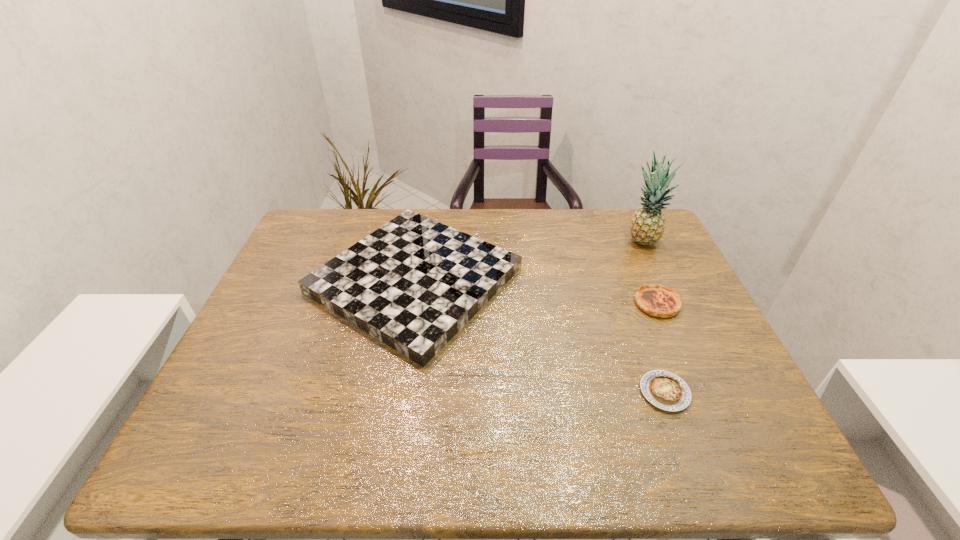
Find the location of a particular element. vacant space at the right edge is located at coordinates (702, 396).

Locate an element on the screen. The width and height of the screenshot is (960, 540). free spot between the farther quiche and the checkerboard is located at coordinates (536, 292).

The height and width of the screenshot is (540, 960). Find the location of `free space between the leftmost object and the nearest object`. free space between the leftmost object and the nearest object is located at coordinates (540, 336).

Identify the location of free space between the third tallest object and the pineapple. (649, 272).

This screenshot has width=960, height=540. What are the coordinates of `free area in between the farther quiche and the nearest object` in the screenshot? It's located at (660, 348).

The height and width of the screenshot is (540, 960). In order to click on blank region between the leftmost object and the farther quiche in this screenshot , I will do `click(536, 292)`.

Locate an element on the screen. The width and height of the screenshot is (960, 540). blank region between the taller quiche and the tallest object is located at coordinates (649, 272).

Find the location of `free spot between the taller quiche and the tallest object`. free spot between the taller quiche and the tallest object is located at coordinates (649, 272).

Identify the location of vacant space that's between the second shortest object and the checkerboard. The image size is (960, 540). (536, 292).

I want to click on vacant space that is in between the pineapple and the taller quiche, so click(649, 272).